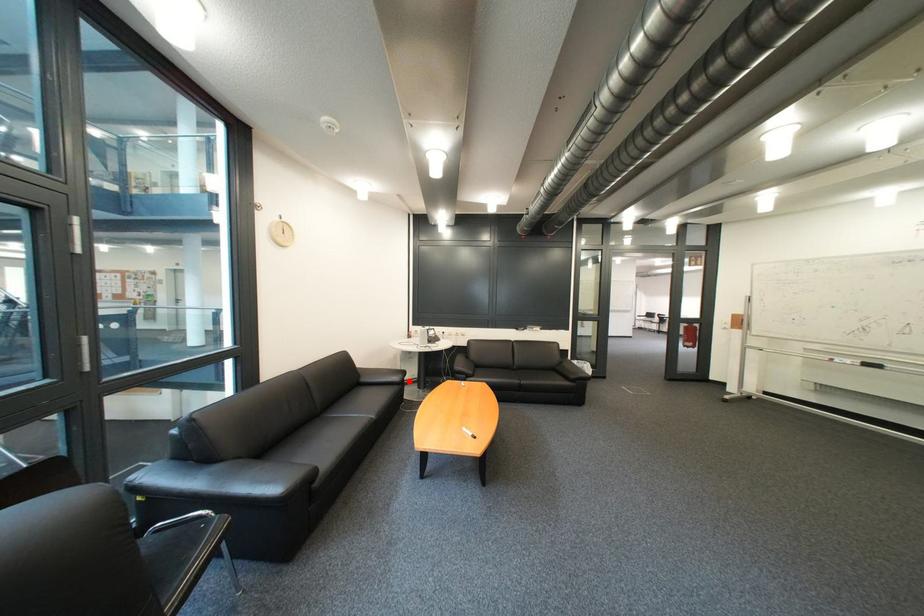
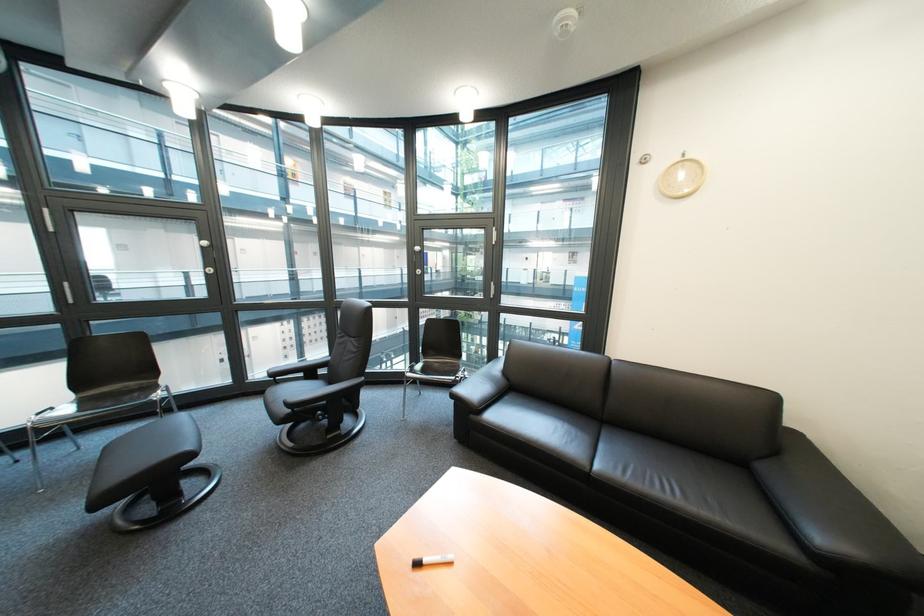
Where in the second image is the point corresponding to the highlighted location from the first image?

(833, 540)